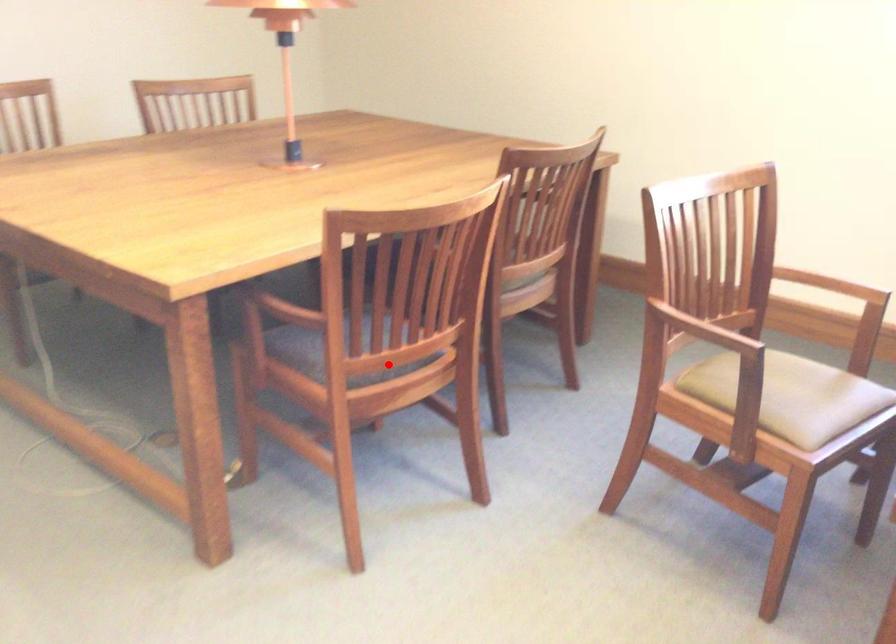
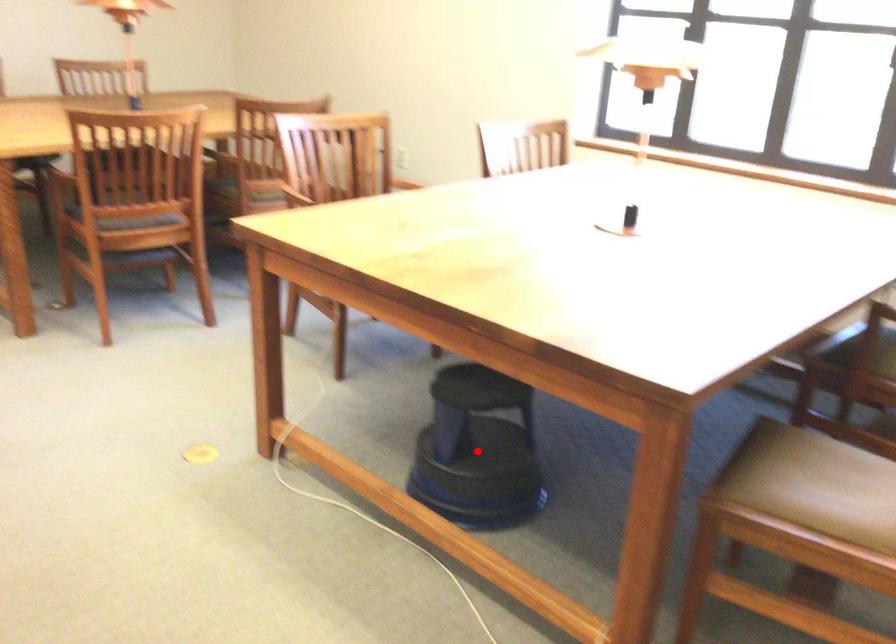
I am providing you with two images of the same scene from different viewpoints. A red point is marked on the first image and another point is marked on the second image. Does the point marked in image1 correspond to the same location as the one in image2?

No